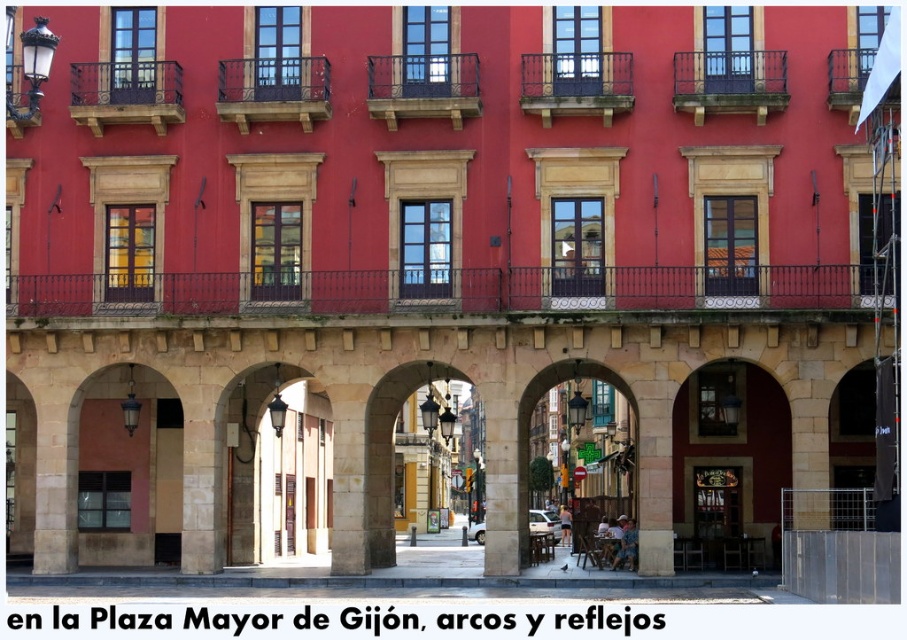
Can you confirm if brown stone archway at center is taller than stone archway at center?

No, brown stone archway at center is not taller than stone archway at center.

Looking at this image, is brown stone archway at center closer to the viewer compared to stone archway at center?

Yes, it is in front of stone archway at center.

Identify the location of brown stone archway at center. (584, 449).

Based on the photo, who is higher up, polished wrought iron balcony at center or dark brown wrought iron balcony at upper right?

dark brown wrought iron balcony at upper right is above.

At what (x,y) coordinates should I click in order to perform the action: click on polished wrought iron balcony at center. Please return your answer as a coordinate pair (x, y). Image resolution: width=907 pixels, height=640 pixels. Looking at the image, I should click on 444,291.

From the picture: Is matte black balcony at center shorter than metallic black balcony at upper right?

Yes.

Describe the element at coordinates (423, 88) in the screenshot. I see `matte black balcony at center` at that location.

At what (x,y) coordinates should I click in order to perform the action: click on matte black balcony at center. Please return your answer as a coordinate pair (x, y). The height and width of the screenshot is (640, 907). Looking at the image, I should click on point(423,88).